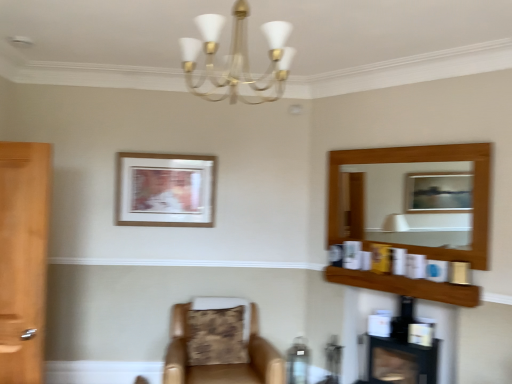
Question: Which is correct: leather at center is inside wooden picture frame at upper center, or outside of it?

Choices:
 (A) inside
 (B) outside

Answer: (B)

Question: In the image, is leather at center on the left side or the right side of wooden picture frame at upper center?

Choices:
 (A) right
 (B) left

Answer: (A)

Question: Which is farther from the matte brown table at lower center?

Choices:
 (A) leather at center
 (B) wooden shelf at upper right
 (C) gold metallic chandelier at upper center
 (D) wooden picture frame at upper center
 (E) black glossy fireplace at lower right

Answer: (C)

Question: Estimate the real-world distances between objects in this image. Which object is closer to the wooden shelf at upper right?

Choices:
 (A) gold metallic chandelier at upper center
 (B) matte brown table at lower center
 (C) black glossy fireplace at lower right
 (D) wooden picture frame at upper center
 (E) leather at center

Answer: (C)